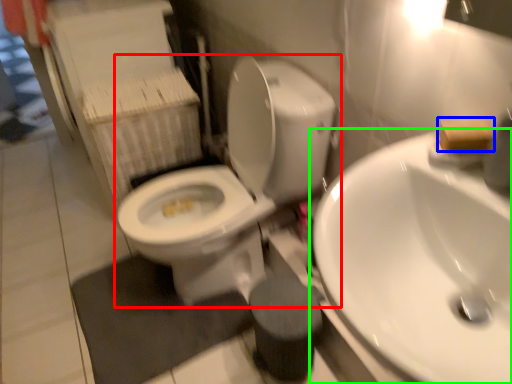
Question: Which object is the farthest from toilet (highlighted by a red box)? Choose among these: soap (highlighted by a blue box) or sink (highlighted by a green box).

Choices:
 (A) soap
 (B) sink

Answer: (A)